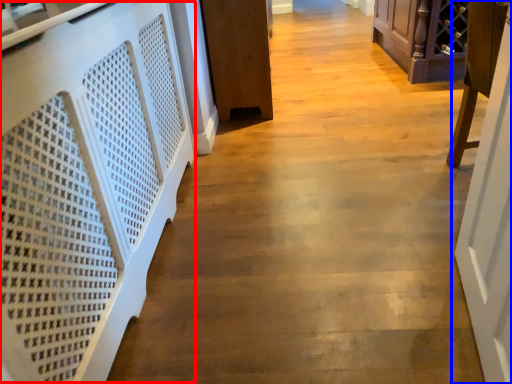
Question: Which point is closer to the camera, stairwell (highlighted by a red box) or door (highlighted by a blue box)?

Choices:
 (A) stairwell
 (B) door

Answer: (A)